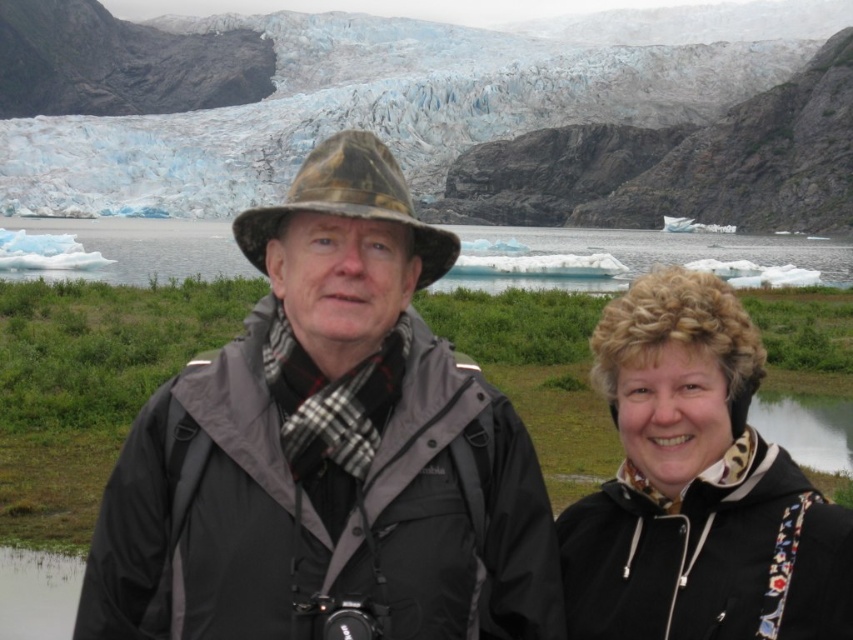
Question: Which point is closer to the camera?

Choices:
 (A) camouflage fabric hat at center
 (B) transparent blue water at center

Answer: (A)

Question: Is rocky cliff at upper center bigger than matte gray jacket at center?

Choices:
 (A) no
 (B) yes

Answer: (B)

Question: Is the position of rocky cliff at upper center more distant than that of transparent blue water at center?

Choices:
 (A) yes
 (B) no

Answer: (A)

Question: Which point appears closest to the camera in this image?

Choices:
 (A) (343, 216)
 (B) (515, 92)
 (C) (624, 330)

Answer: (A)

Question: Does matte gray jacket at center have a greater width compared to transparent blue water at center?

Choices:
 (A) no
 (B) yes

Answer: (A)

Question: Among these points, which one is farthest from the camera?

Choices:
 (A) (445, 32)
 (B) (647, 323)
 (C) (781, 256)
 (D) (306, 342)

Answer: (A)